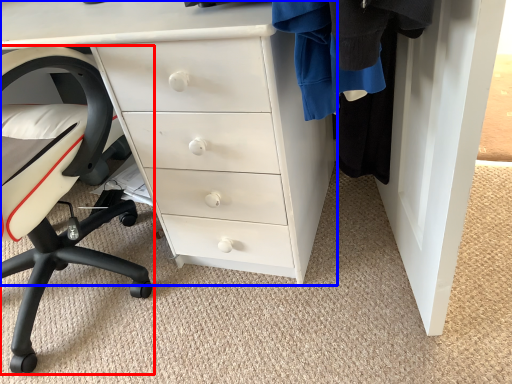
Question: Which object appears farthest to the camera in this image, chair (highlighted by a red box) or chest of drawers (highlighted by a blue box)?

Choices:
 (A) chair
 (B) chest of drawers

Answer: (B)